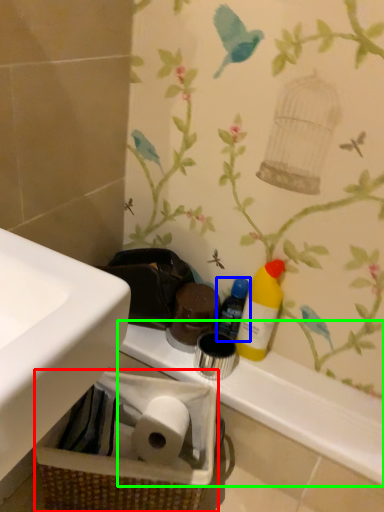
Question: Based on their relative distances, which object is farther from basket container (highlighted by a red box)? Choose from bottle (highlighted by a blue box) and counter top (highlighted by a green box).

Choices:
 (A) bottle
 (B) counter top

Answer: (A)